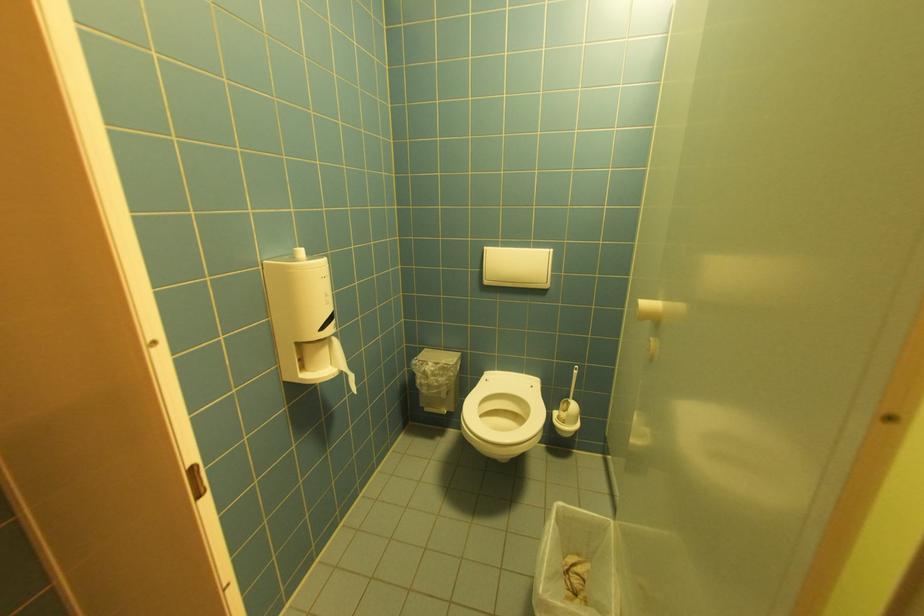
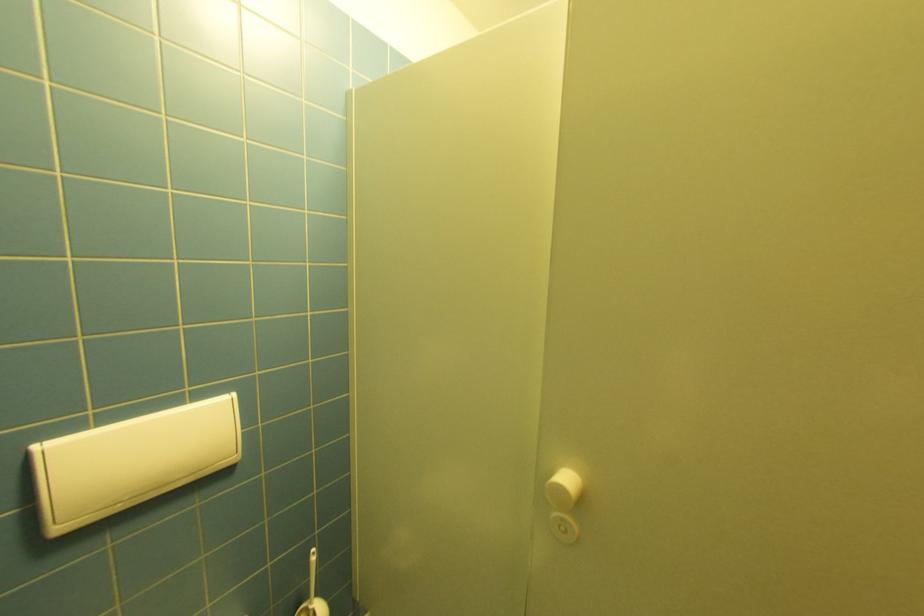
Find the pixel in the second image that matches the point at 574,402 in the first image.

(312, 610)